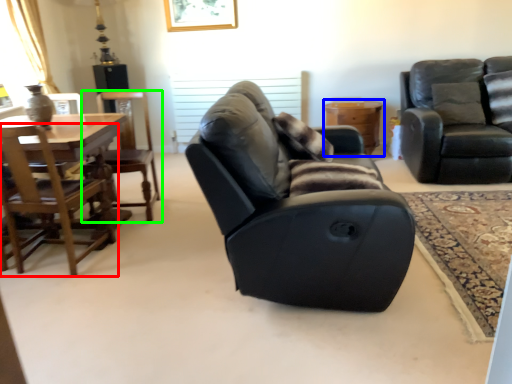
Question: Considering the real-world distances, which object is farthest from chair (highlighted by a red box)? table (highlighted by a blue box) or chair (highlighted by a green box)?

Choices:
 (A) table
 (B) chair

Answer: (A)